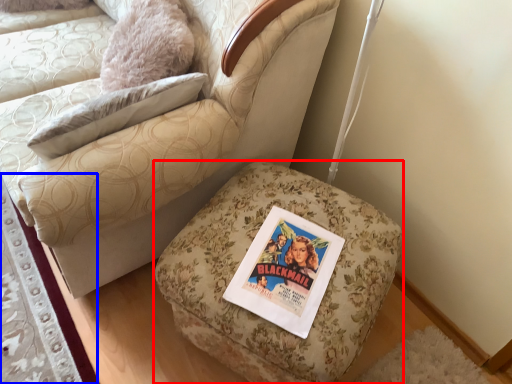
Question: Which point is further to the camera, furniture (highlighted by a red box) or mat (highlighted by a blue box)?

Choices:
 (A) furniture
 (B) mat

Answer: (B)